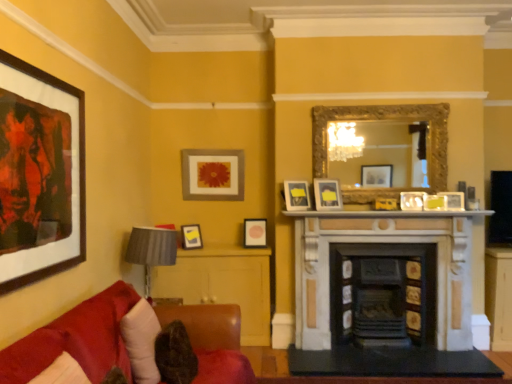
Question: Does matte white picture frame at center-right, arranged as the 7th picture frame when viewed from the back, come behind velvet red couch at lower left?

Choices:
 (A) yes
 (B) no

Answer: (A)

Question: Is matte white picture frame at center-right, the 8th picture frame positioned from the left, closer to camera compared to velvet red couch at lower left?

Choices:
 (A) yes
 (B) no

Answer: (B)

Question: Is velvet red couch at lower left completely or partially inside matte white picture frame at center-right, which is counted as the first picture frame, starting from the right?

Choices:
 (A) no
 (B) yes

Answer: (A)

Question: Considering the relative sizes of matte white picture frame at center-right, arranged as the 7th picture frame when viewed from the back, and velvet red couch at lower left in the image provided, is matte white picture frame at center-right, arranged as the 7th picture frame when viewed from the back, wider than velvet red couch at lower left?

Choices:
 (A) no
 (B) yes

Answer: (A)

Question: From a real-world perspective, is matte white picture frame at center-right, the second picture frame positioned from the front, positioned under velvet red couch at lower left based on gravity?

Choices:
 (A) no
 (B) yes

Answer: (A)

Question: Can you confirm if matte white picture frame at center-right, arranged as the 7th picture frame when viewed from the back, is smaller than velvet red couch at lower left?

Choices:
 (A) yes
 (B) no

Answer: (A)

Question: From the image's perspective, is white marble fireplace at center over matte white picture frame at center, which is counted as the 4th picture frame, starting from the back?

Choices:
 (A) yes
 (B) no

Answer: (B)

Question: Is white marble fireplace at center oriented away from matte white picture frame at center, the 2th picture frame when ordered from right to left?

Choices:
 (A) yes
 (B) no

Answer: (B)

Question: From a real-world perspective, is white marble fireplace at center located higher than matte white picture frame at center, the seventh picture frame from the left?

Choices:
 (A) yes
 (B) no

Answer: (B)

Question: Would you consider white marble fireplace at center to be distant from matte white picture frame at center, which appears as the fifth picture frame when viewed from the front?

Choices:
 (A) yes
 (B) no

Answer: (B)

Question: Is white marble fireplace at center aimed at matte white picture frame at center, the 2th picture frame when ordered from right to left?

Choices:
 (A) yes
 (B) no

Answer: (B)

Question: Is matte white picture frame at center, the seventh picture frame from the left, completely or partially inside white marble fireplace at center?

Choices:
 (A) no
 (B) yes

Answer: (A)

Question: From the image's perspective, is white fabric pillow at lower left on matte black picture frame at center, the 7th picture frame when ordered from front to back?

Choices:
 (A) no
 (B) yes

Answer: (A)